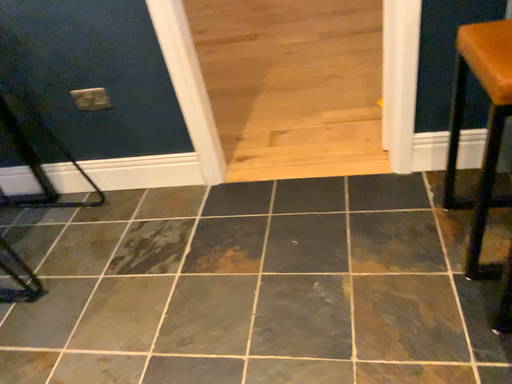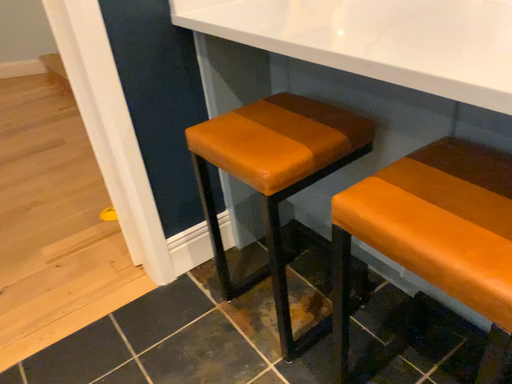
Question: How did the camera likely rotate when shooting the video?

Choices:
 (A) rotated upward
 (B) rotated downward

Answer: (A)